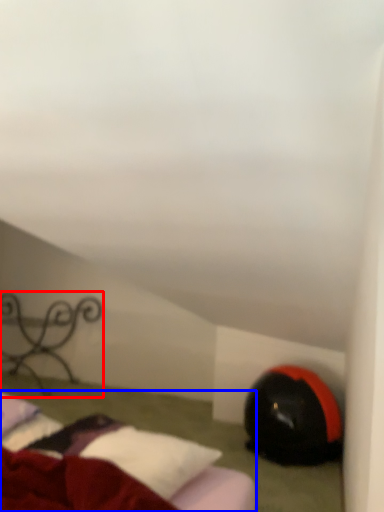
Question: Among these objects, which one is nearest to the camera, furniture (highlighted by a red box) or bed (highlighted by a blue box)?

Choices:
 (A) furniture
 (B) bed

Answer: (B)